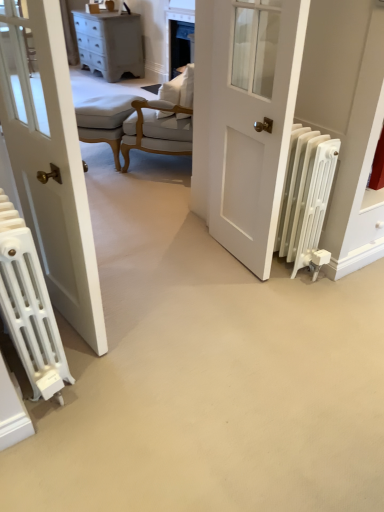
Locate an element on the screen. free location in front of white matte radiator at right, placed as the 1th radiator when sorted from right to left is located at coordinates (296, 298).